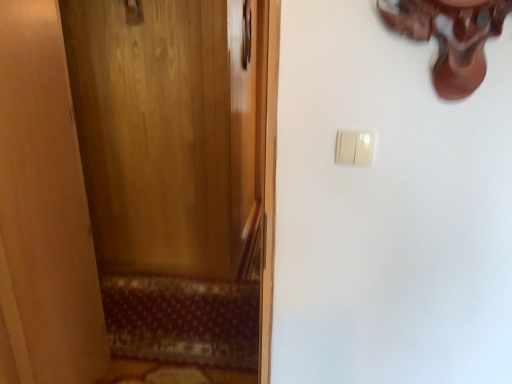
Question: From a real-world perspective, is wooden door at left positioned above or below patterned carpet at lower left?

Choices:
 (A) below
 (B) above

Answer: (B)

Question: Looking at their shapes, would you say wooden door at left is wider or thinner than patterned carpet at lower left?

Choices:
 (A) wide
 (B) thin

Answer: (B)

Question: Considering the real-world distances, which object is closest to the patterned carpet at lower left?

Choices:
 (A) white plastic light switch at upper right
 (B) wooden door at left
 (C) polished brass door handle at upper left

Answer: (B)

Question: Estimate the real-world distances between objects in this image. Which object is closer to the wooden door at left?

Choices:
 (A) patterned carpet at lower left
 (B) polished brass door handle at upper left
 (C) white plastic light switch at upper right

Answer: (A)